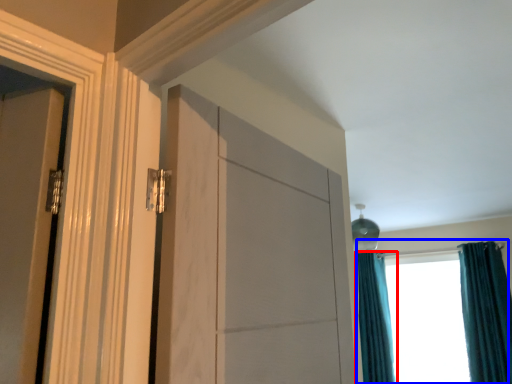
Question: Which object is further to the camera taking this photo, curtain (highlighted by a red box) or window (highlighted by a blue box)?

Choices:
 (A) curtain
 (B) window

Answer: (A)